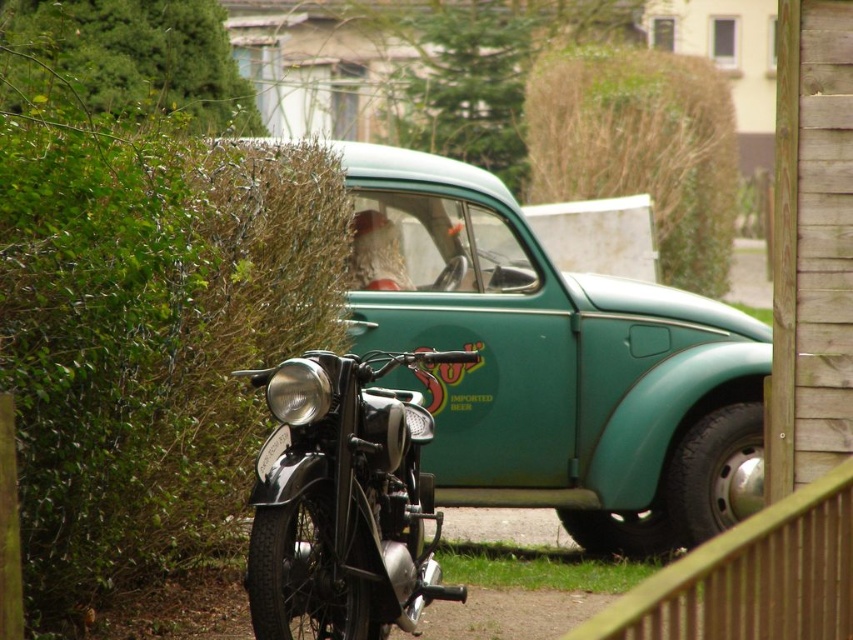
You are a photographer standing in front of the teal matte car at center and the brown textured hedge at upper center. You want to take a photo of both objects in the same frame. Which object should you focus on first to ensure both are in focus?

The teal matte car at center is closer to the viewer than the brown textured hedge at upper center. To ensure both are in focus, you should focus on the teal matte car at center first, as it is closer, and the hedge will naturally be in focus due to the depth of field extending from the car to the hedge.

You are standing at a distance and looking at the vintage green Volkswagen Beetle parked next to a motorcycle. There is a specific point at coordinates point (643, 490). Can you tell me how far this point is from you in meters?

The distance of point (643, 490) from the viewer is 10.58 meters.

You are a photographer trying to capture both the teal matte car at center and the brown textured hedge at upper center in a single frame. Given that the car is smaller than the hedge, how should you adjust your camera position to ensure both are fully visible?

Since the teal matte car at center is smaller than the brown textured hedge at upper center, you should position your camera closer to the car and angle it slightly upward to include the entire hedge in the frame while keeping the car centered.